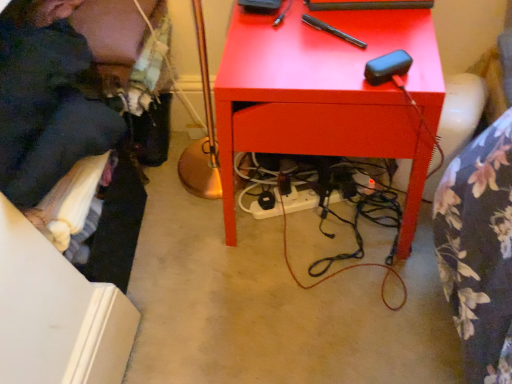
Identify the location of free spot below dark blue fabric at left (from a real-world perspective). The height and width of the screenshot is (384, 512). point(156,168).